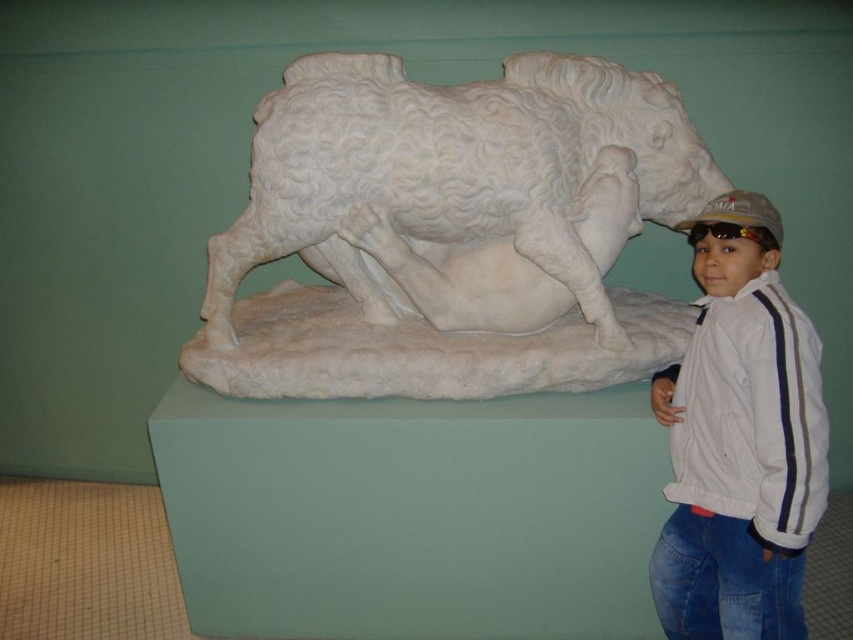
You are a photographer setting up a shot of the white marble sculpture at center and the white matte baseball cap at upper right. Which object should you focus on first if you want to capture both in the same frame without adjusting your camera settings?

The white marble sculpture at center is taller than the white matte baseball cap at upper right, so you should focus on the white marble sculpture at center first to ensure proper depth of field for both objects.

You are standing in front of the white marble ram sculpture and notice two points marked on the wall. The first point is at coordinates point (811,492) and the second is at point (747,196). Which point is closer to you?

Point (811,492) is closer to the viewer than point (747,196).

You are an art curator planning to display the white marble sculpture at center and the white matte baseball cap at upper right in a new exhibition. The display case you have is 1.2 meters wide. Can both items fit side by side without overlapping?

The white marble sculpture at center might be wider than white matte baseball cap at upper right. Since the total width of both items combined could exceed 1.2 meters, it is uncertain if they will fit without overlapping. Further measurements are needed to confirm.